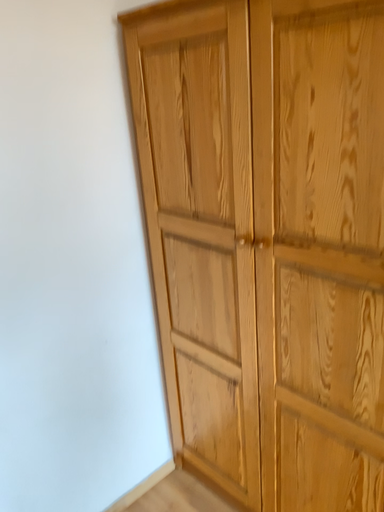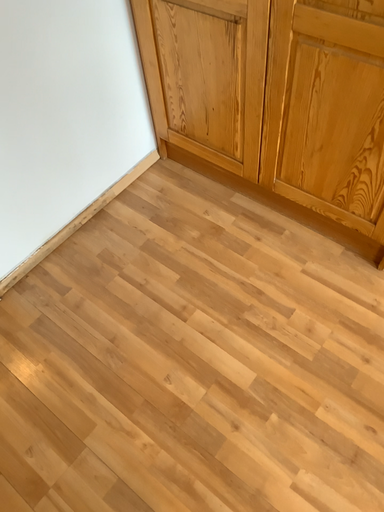
Question: How did the camera likely rotate when shooting the video?

Choices:
 (A) rotated left
 (B) rotated right

Answer: (B)